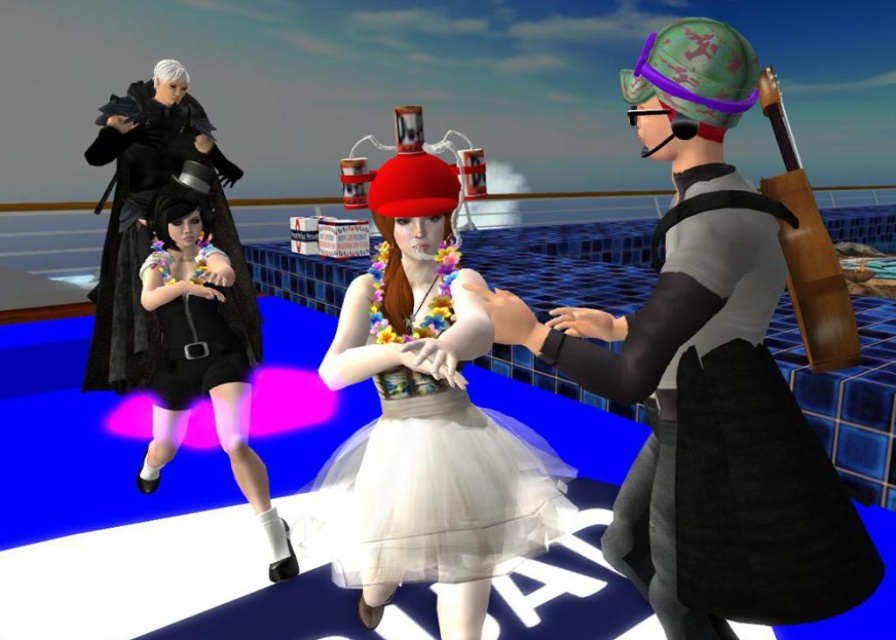
You are a fashion designer observing two dresses displayed side by side on mannequins. The black matte dress at left and the black satin dress at left are both on display. Which dress is taller?

The black matte dress at left is taller than the black satin dress at left.

You are standing at the pool deck and want to throw a ball to a friend. You have two points to choose from on the deck. One is at point (727, 396) and the other is at point (190, 317). Which point is closer to you so that you can throw the ball more accurately?

Point (727, 396) is closer to the camera than point (190, 317), so you should choose point (727, 396) to throw the ball more accurately.